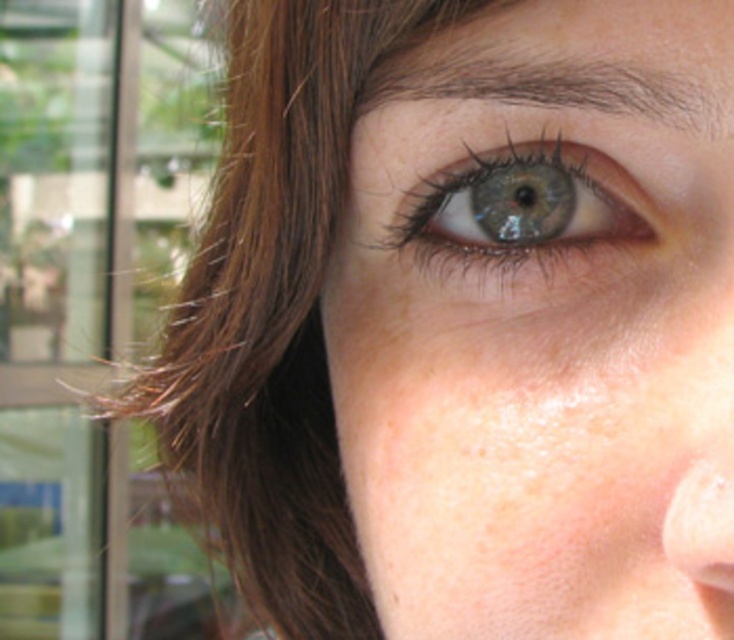
Question: Which point is farther to the camera?

Choices:
 (A) blue glossy eye at center
 (B) smooth skin eye at center

Answer: (A)

Question: In this image, where is smooth skin eye at center located relative to blue glossy eye at center?

Choices:
 (A) left
 (B) right

Answer: (B)

Question: Is smooth skin eye at center wider than blue glossy eye at center?

Choices:
 (A) no
 (B) yes

Answer: (B)

Question: Which point is closer to the camera?

Choices:
 (A) (694, 506)
 (B) (501, 186)

Answer: (A)

Question: Does smooth skin eye at center have a smaller size compared to blue glossy eye at center?

Choices:
 (A) yes
 (B) no

Answer: (B)